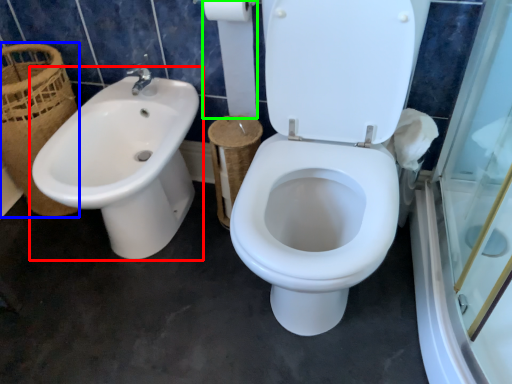
Question: Estimate the real-world distances between objects in this image. Which object is closer to sink (highlighted by a red box), basket (highlighted by a blue box) or toilet paper (highlighted by a green box)?

Choices:
 (A) basket
 (B) toilet paper

Answer: (A)